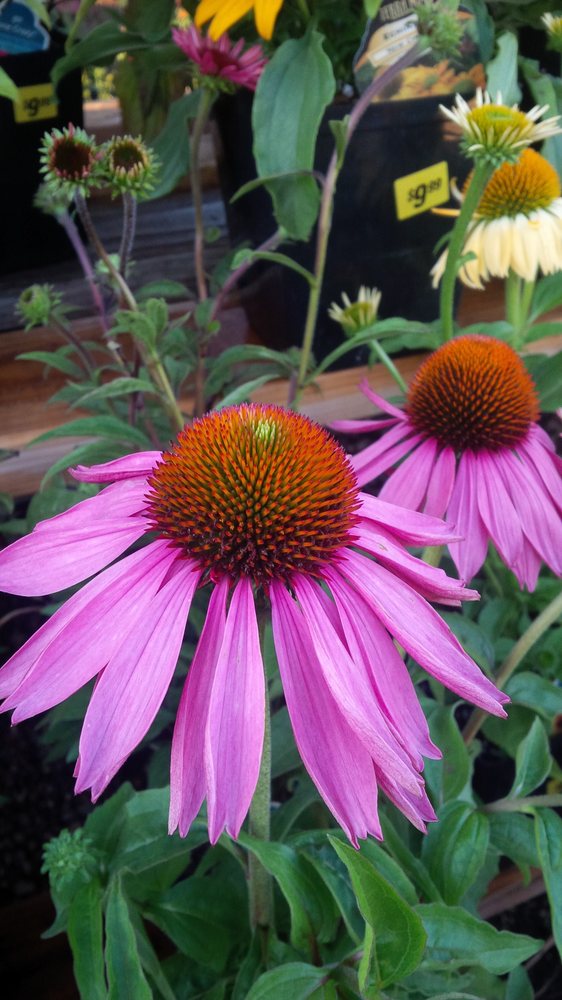
Locate an element on the screen. plastic pot is located at coordinates (380, 157).